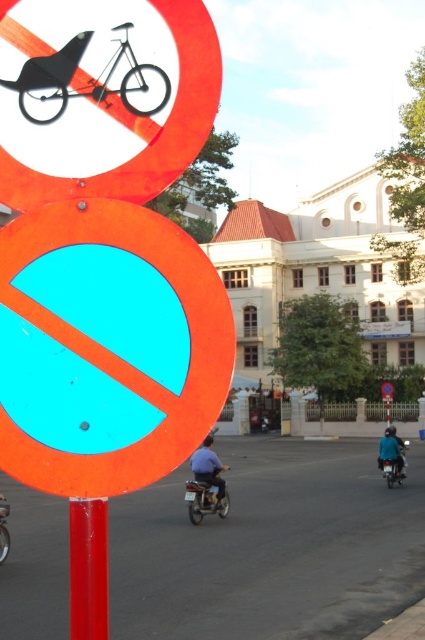
You are standing at the point marked as point (99, 602) and want to move towards the point marked as point (223, 467). According to the scene, will you be moving away from or towards the camera?

Since point (99, 602) is closer to the camera than point (223, 467), moving from point (99, 602) to point (223, 467) means you are moving away from the camera.

You are a delivery person who needs to attach a parcel to the smooth red pole at center and the blue fabric shirt at center. Which object will allow you to tie the parcel more securely due to its larger width?

The blue fabric shirt at center has a greater width than the smooth red pole at center, so it will allow you to tie the parcel more securely.

You are a delivery driver who needs to determine if the matte black bicycle at upper left can fit through a narrow alley that the smooth red pole at center is blocking. Based on their sizes, can the bicycle pass through the space next to the pole?

The matte black bicycle at upper left is larger in size than the smooth red pole at center, so it may not fit through the space next to the pole without adjustments or moving the pole.